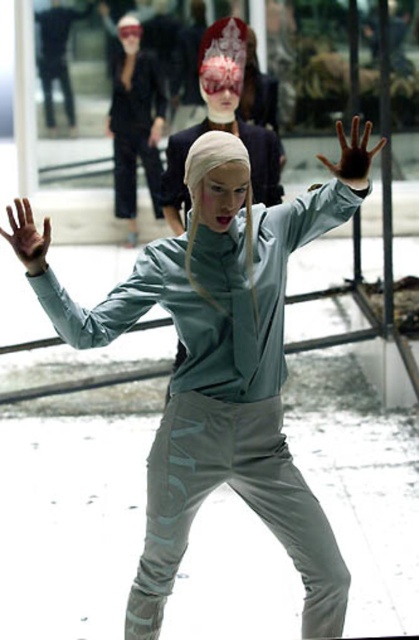
You are an artist trying to paint the scene. The brown matte hand at center and the matte black arm at upper center are both important elements. Based on their sizes, which one should you paint first to ensure proper proportions?

The brown matte hand at center might be wider than the matte black arm at upper center, so you should paint the brown matte hand at center first to ensure proper proportions.

You are a photographer trying to capture the matte silver headscarf at center in the image. The camera you are using has a fixed focus point at coordinates point (224, 116). Will the focus point align with the matte silver headscarf at center?

Yes, the focus point at coordinates point (224, 116) aligns with the matte silver headscarf at center as indicated by the description.

You are a photographer standing in front of the scene. You want to take a photo that captures both the matte silver headscarf at center and the matte gray hand at center clearly. Which object should you focus on first to ensure both are in focus?

The matte silver headscarf at center is closer to the viewer than the matte gray hand at center. To ensure both are in focus, focus on the matte silver headscarf at center first.